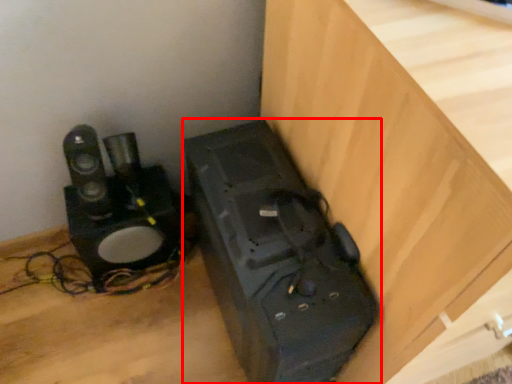
Question: From the image's perspective, where is appliance (annotated by the red box) located in relation to furniture in the image?

Choices:
 (A) above
 (B) below

Answer: (B)